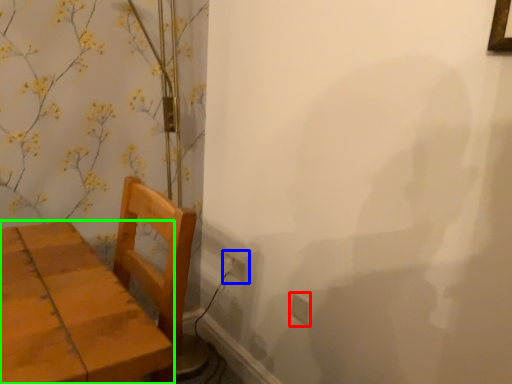
Question: Estimate the real-world distances between objects in this image. Which object is farther from electric outlet (highlighted by a red box), electric outlet (highlighted by a blue box) or furniture (highlighted by a green box)?

Choices:
 (A) electric outlet
 (B) furniture

Answer: (B)